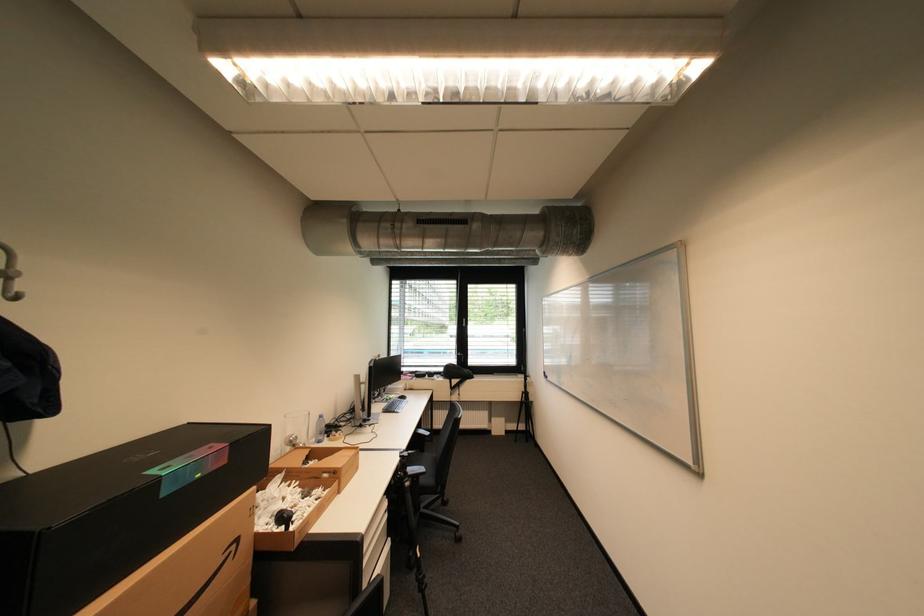
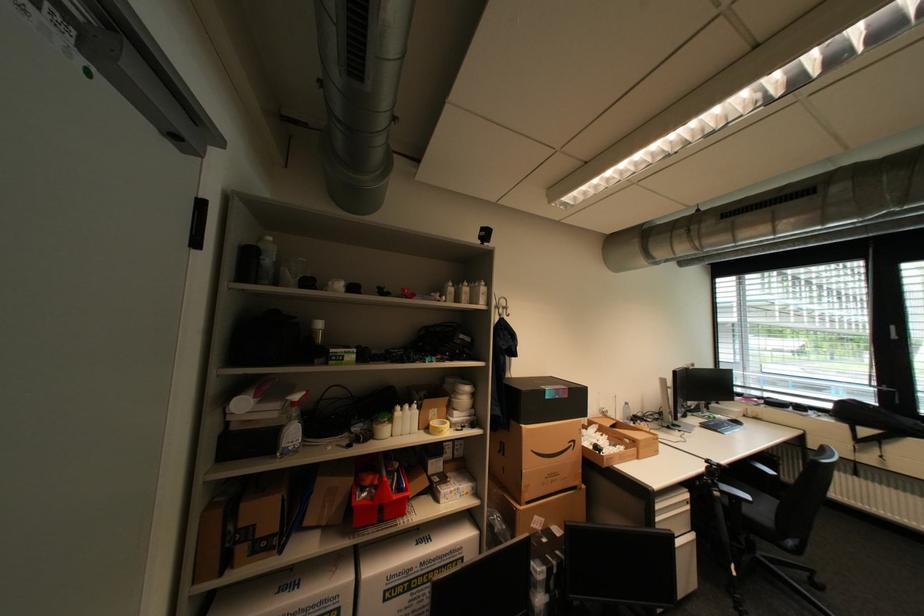
Question: The images are taken continuously from a first-person perspective. In which direction is your viewpoint rotating?

Choices:
 (A) Left
 (B) Right
 (C) Up
 (D) Down

Answer: (A)